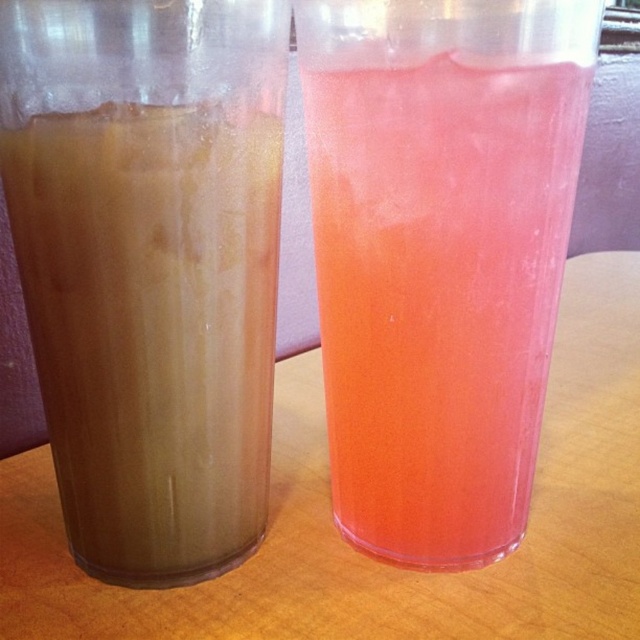
You are a barista preparing drinks and need to place the translucent orange juice at right and the brown translucent cup at left on a shelf. Which drink should you place first to ensure they are arranged from left to right as shown in the image?

You should place the brown translucent cup at left first because it is on the left side of the translucent orange juice at right in the image.

You are a customer at a cafe and want to order a drink. You see two cups on the table. One has a brownish liquid with a creamy texture and frothy top, and the other has a vibrant pink liquid. The point at coordinates (438, 292) is part of the translucent orange juice at right. Which cup should you point to if you want the orange juice?

You should point to the cup on the right because the point at coordinates (438, 292) corresponds to the translucent orange juice at right, which is the vibrant pink liquid in the cup on the right.

You are a customer at a cafe and want to grab both cups. The first cup is at point [458,97] and the second is at point [102,490]. Which cup should you reach for first if you want to pick up the one closer to you?

You should reach for the cup at point [458,97] first because it is closer to you than the cup at point [102,490].